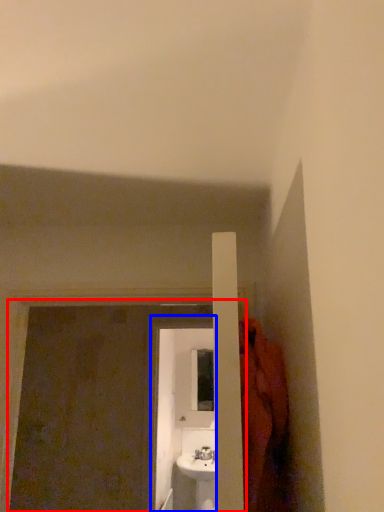
Question: Which object is closer to the camera taking this photo, screen door (highlighted by a red box) or screen door (highlighted by a blue box)?

Choices:
 (A) screen door
 (B) screen door

Answer: (A)